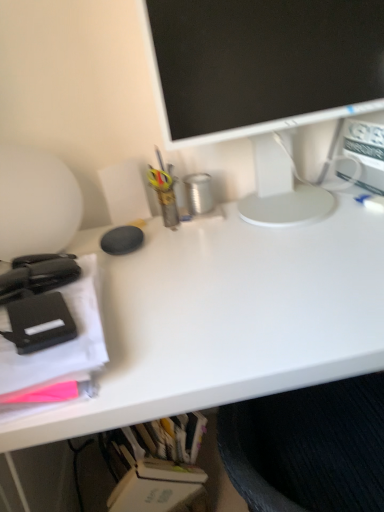
Question: From their relative heights in the image, would you say matte black stapler at left, which appears as the 2th office supplies when viewed from the back, is taller or shorter than black matte stapler at left, which ranks as the first office supplies in back-to-front order?

Choices:
 (A) tall
 (B) short

Answer: (A)

Question: Relative to black matte stapler at left, which appears as the second office supplies when viewed from the front, is matte black stapler at left, which appears as the 2th office supplies when viewed from the back, in front or behind?

Choices:
 (A) behind
 (B) front

Answer: (B)

Question: Which of these objects is positioned farthest from the white glossy monitor at upper center?

Choices:
 (A) matte black stapler at left, arranged as the first office supplies when viewed from the front
 (B) white matte desk at center
 (C) black matte stapler at left, which ranks as the first office supplies in back-to-front order

Answer: (C)

Question: Estimate the real-world distances between objects in this image. Which object is farther from the white glossy monitor at upper center?

Choices:
 (A) matte black stapler at left, arranged as the first office supplies when viewed from the front
 (B) white matte desk at center
 (C) black matte stapler at left, which ranks as the first office supplies in back-to-front order

Answer: (C)